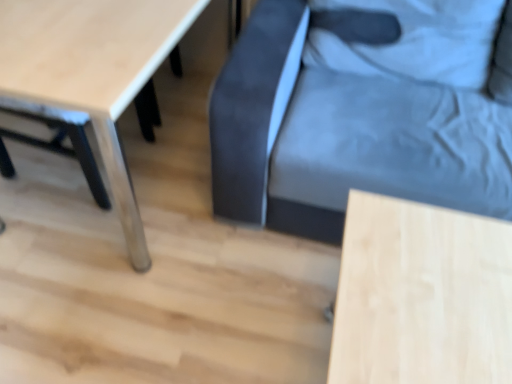
Identify the location of blank space situated above light wood table at lower right, acting as the second table starting from the left (from a real-world perspective). (438, 286).